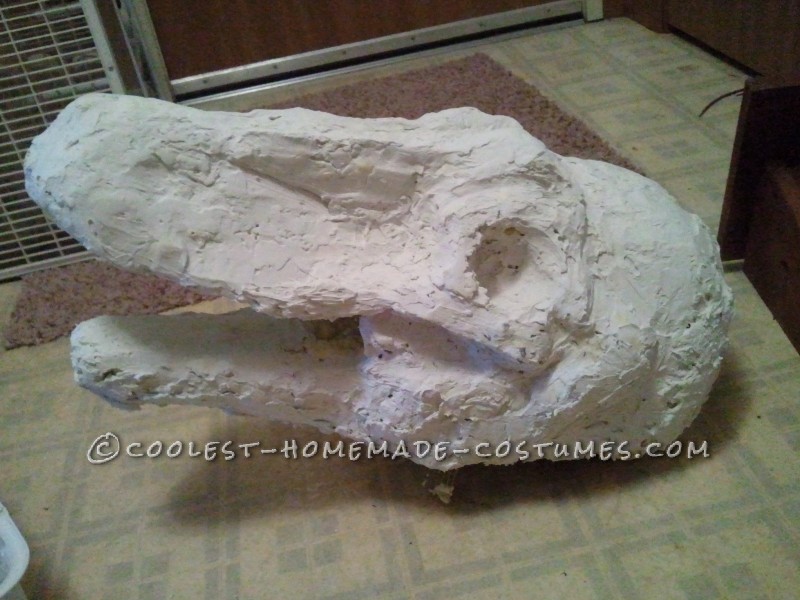
At what (x,y) coordinates should I click in order to perform the action: click on rug. Please return your answer as a coordinate pair (x, y). Looking at the image, I should click on (436, 82), (62, 300).